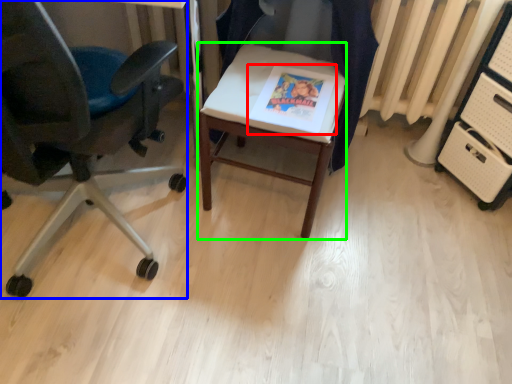
Question: Considering the real-world distances, which object is closest to magazine (highlighted by a red box)? chair (highlighted by a blue box) or desk (highlighted by a green box).

Choices:
 (A) chair
 (B) desk

Answer: (B)